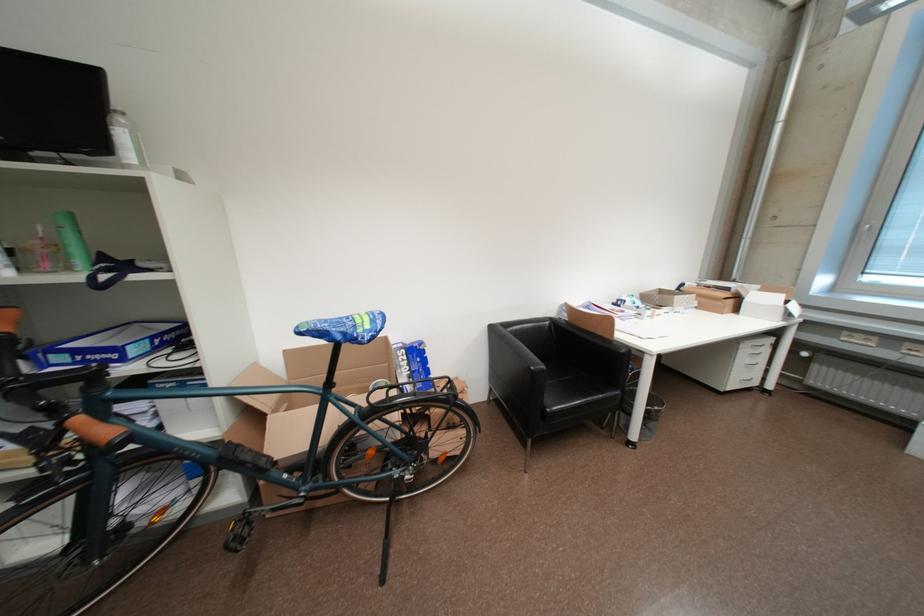
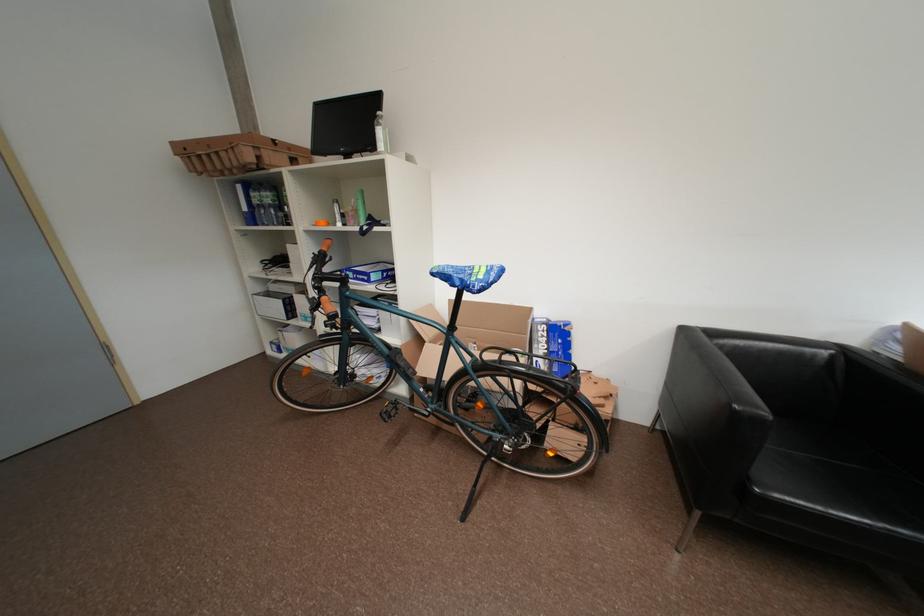
The point at (464,399) is marked in the first image. Where is the corresponding point in the second image?

(582, 391)